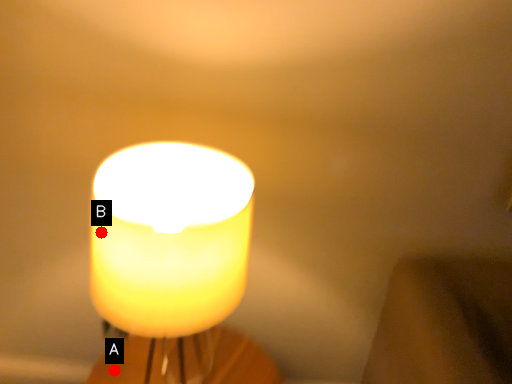
Question: Two points are circled on the image, labeled by A and B beside each circle. Which point is closer to the camera taking this photo?

Choices:
 (A) A is closer
 (B) B is closer

Answer: (B)